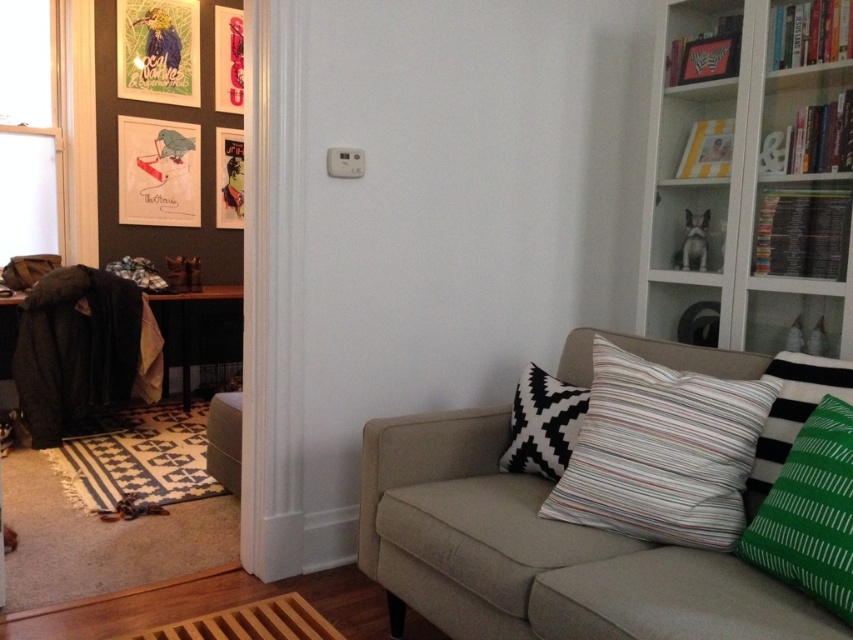
Question: Observing the image, what is the correct spatial positioning of white glass bookshelf at upper right in reference to striped fabric pillow at center?

Choices:
 (A) below
 (B) above

Answer: (B)

Question: Does striped fabric pillow at center appear on the left side of green striped pillow at right?

Choices:
 (A) yes
 (B) no

Answer: (A)

Question: Which of the following is the farthest from the observer?

Choices:
 (A) (640, 632)
 (B) (740, 179)
 (C) (537, 394)

Answer: (B)

Question: Is beige fabric couch at center to the right of green striped pillow at right from the viewer's perspective?

Choices:
 (A) no
 (B) yes

Answer: (A)

Question: Which point is farther to the camera?

Choices:
 (A) white glass bookshelf at upper right
 (B) green striped pillow at right

Answer: (A)

Question: Which object appears farthest from the camera in this image?

Choices:
 (A) striped fabric pillow at center
 (B) green striped pillow at right
 (C) black and white zigzag pillow at upper right

Answer: (C)